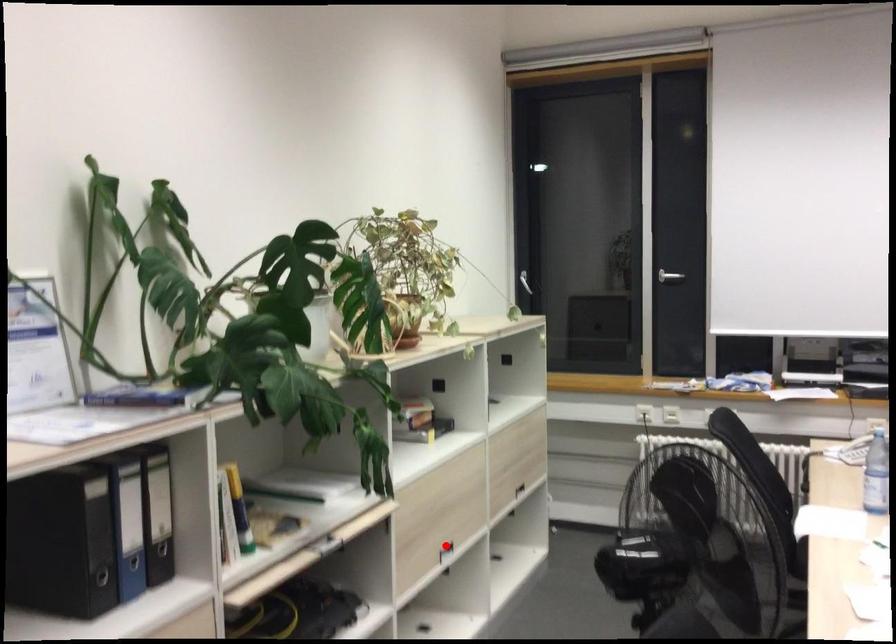
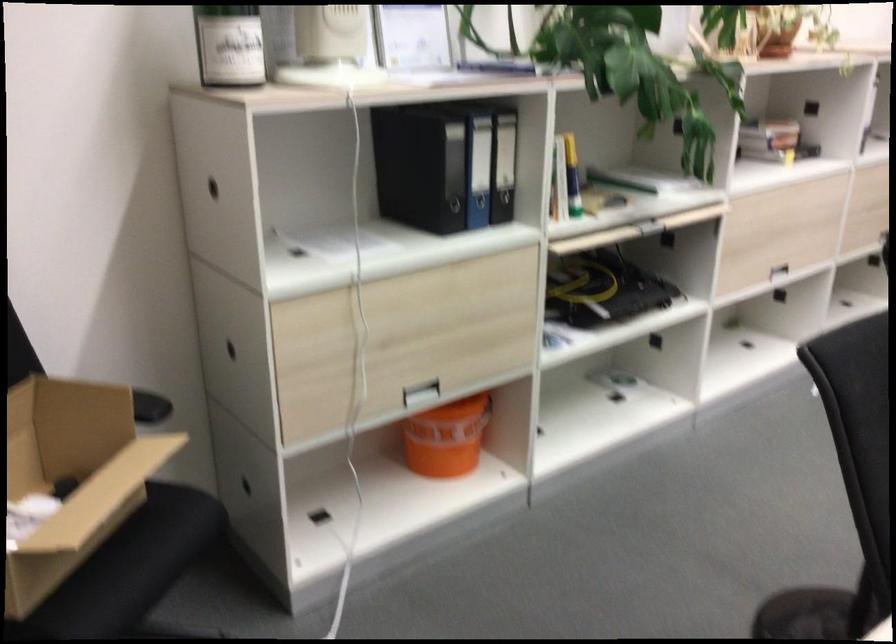
The point at the highlighted location is marked in the first image. Where is the corresponding point in the second image?

(771, 266)